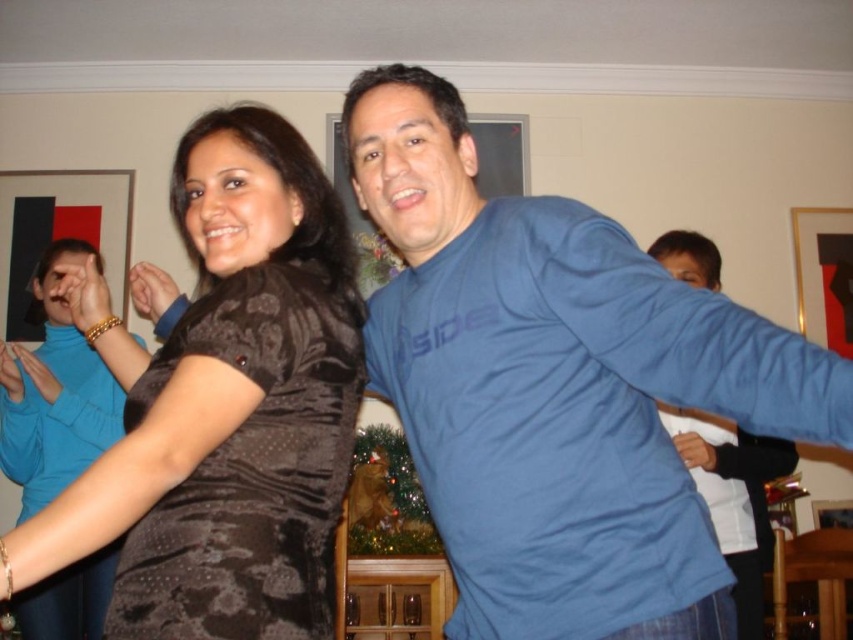
Question: Can you confirm if matte black dress at center is smaller than blue cotton shirt at right?

Choices:
 (A) no
 (B) yes

Answer: (A)

Question: Is blue cotton shirt at center positioned in front of velvet brown dress at left?

Choices:
 (A) no
 (B) yes

Answer: (B)

Question: Which is nearer to the matte black dress at center?

Choices:
 (A) blue cotton shirt at center
 (B) velvet brown dress at left

Answer: (B)

Question: Which point is farther to the camera?

Choices:
 (A) (646, 301)
 (B) (306, 388)
 (C) (741, 586)
 (D) (70, 352)

Answer: (D)

Question: Is velvet brown dress at left wider than blue cotton shirt at right?

Choices:
 (A) yes
 (B) no

Answer: (B)

Question: Estimate the real-world distances between objects in this image. Which object is closer to the blue cotton shirt at center?

Choices:
 (A) velvet brown dress at left
 (B) blue cotton shirt at right
 (C) matte black dress at center

Answer: (A)